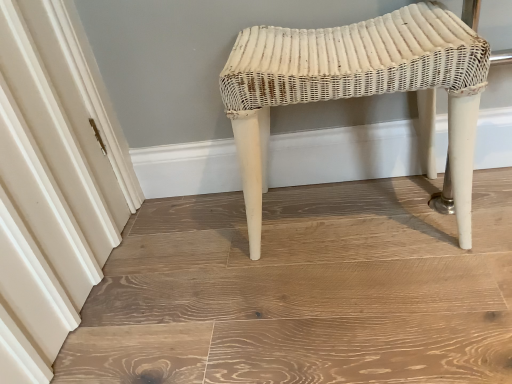
Describe the element at coordinates (357, 88) in the screenshot. I see `white wicker stool at center` at that location.

I want to click on white wicker stool at center, so click(357, 88).

Image resolution: width=512 pixels, height=384 pixels. In order to click on white wicker stool at center in this screenshot , I will do `click(357, 88)`.